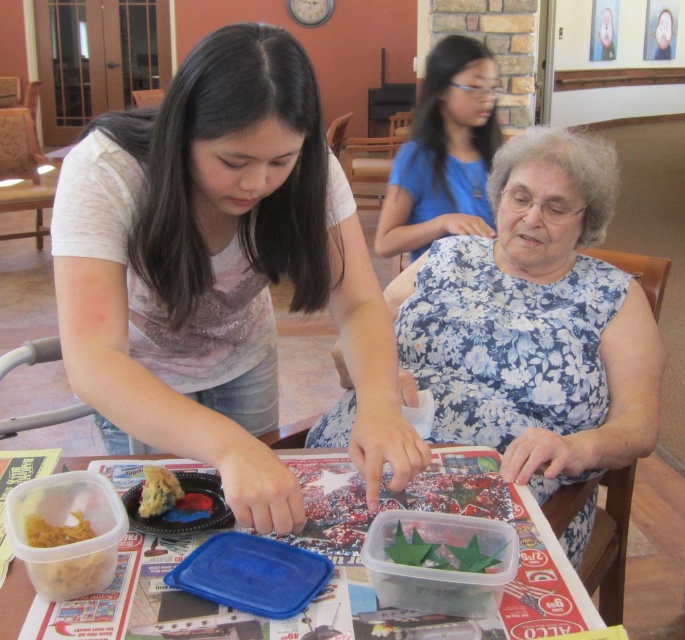
You are a photographer setting up for a group photo in this scene. You need to ensure that the white floral dress at center and the brown crumbly cake at lower left are both visible in the frame. Considering their sizes, which object might require more space in the composition to accommodate its width?

The white floral dress at center requires more space in the composition because its width is larger than the brown crumbly cake at lower left.

You are a photographer trying to capture a closeup of the yellowish matte food at lower left without including the matte white shirt at center in the frame. Given their sizes, is this possible?

The matte white shirt at center is bigger than the yellowish matte food at lower left, so it may be challenging to frame the food without including the shirt due to its larger size.

You are a guest at this event and need to locate the brown crumbly cake at lower left. From the perspective of the white floral dress at center, which direction should you move to find it?

The brown crumbly cake at lower left is to the left of the white floral dress at center, so you should move to your left to find it.